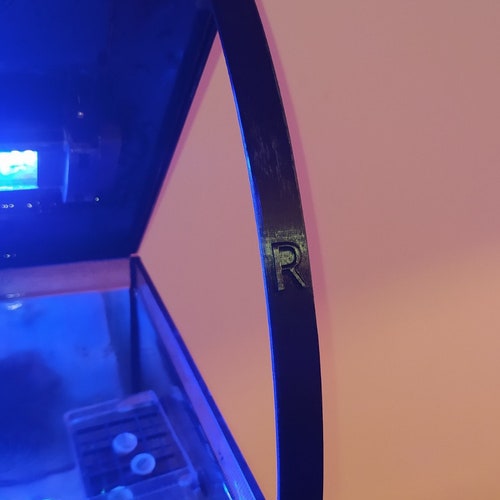
I want to click on inside of the chamber, so click(51, 397).